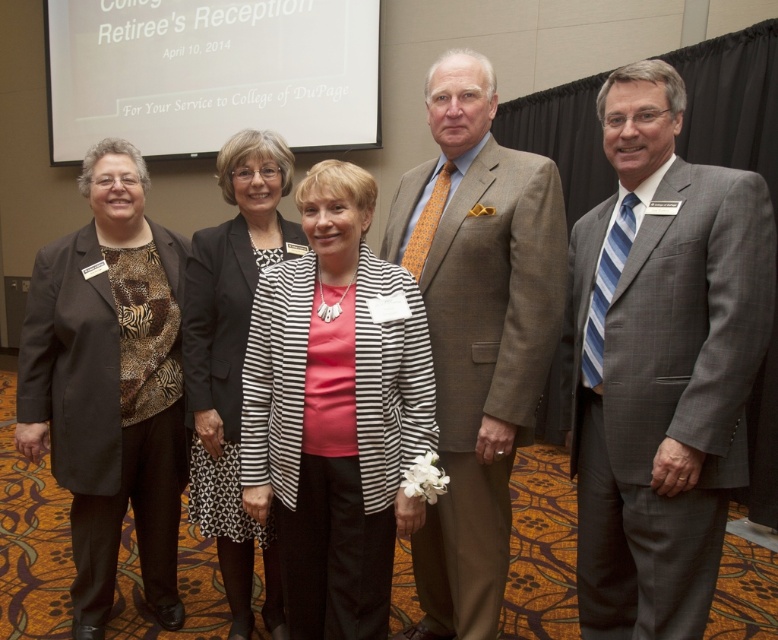
You are standing in the front row of the Retiree Reception photo and want to ensure the striped fabric jacket at center is centered in the group photo. Is the jacket currently positioned at the exact center of the photo?

The striped fabric jacket at center is located at coordinates (335,412), which is not the exact center of the photo. The exact center would be at coordinates (389,320), so the jacket is slightly to the right and above the true center.

You are a photographer adjusting the camera settings for a group photo. The camera has a minimum focus distance requirement of 24 inches. Based on the scene, will the camera be able to focus on both the brown textured suit at center and the black and white striped dress at center simultaneously?

The distance between the brown textured suit at center and the black and white striped dress at center is 23.75 inches, which is less than the camera minimum focus distance of 24 inches. Therefore, the camera cannot focus on both simultaneously.

You are attending the Retiree Reception and notice two outfits at the center of the image. The brown textured suit at center and the black and white striped dress at center. Which one is positioned higher up?

The brown textured suit at center is above the black and white striped dress at center, so it is positioned higher up.